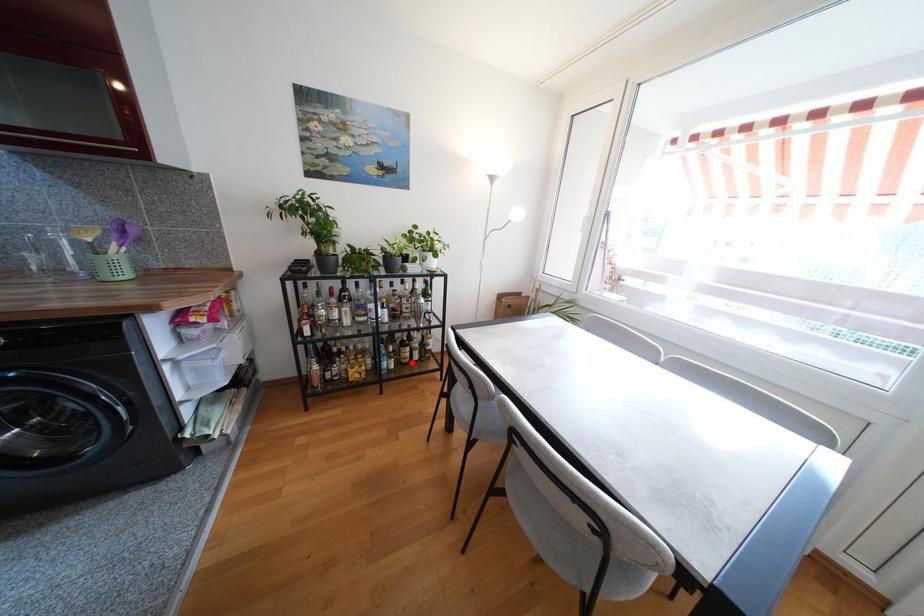
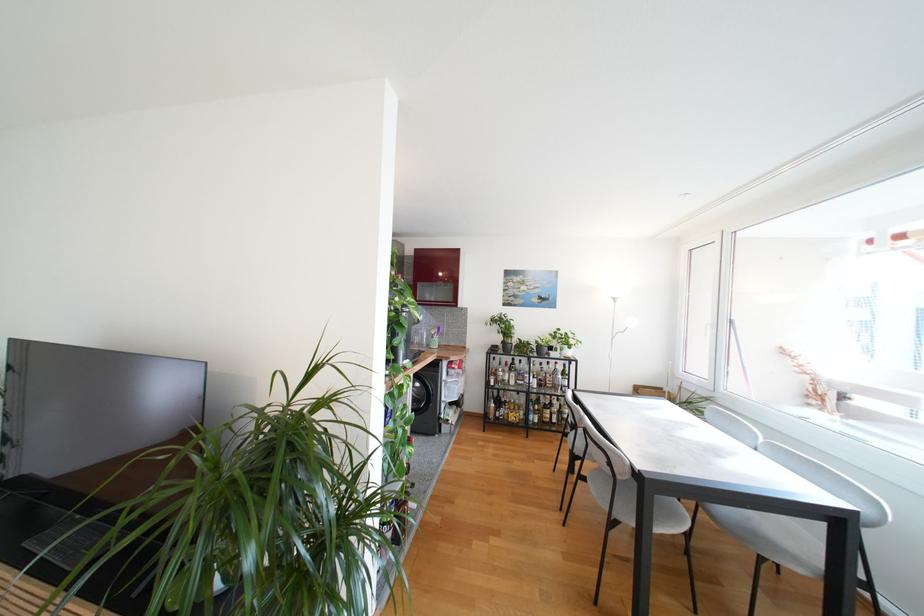
Find the pixel in the second image that matches the highlighted location in the first image.

(553, 423)